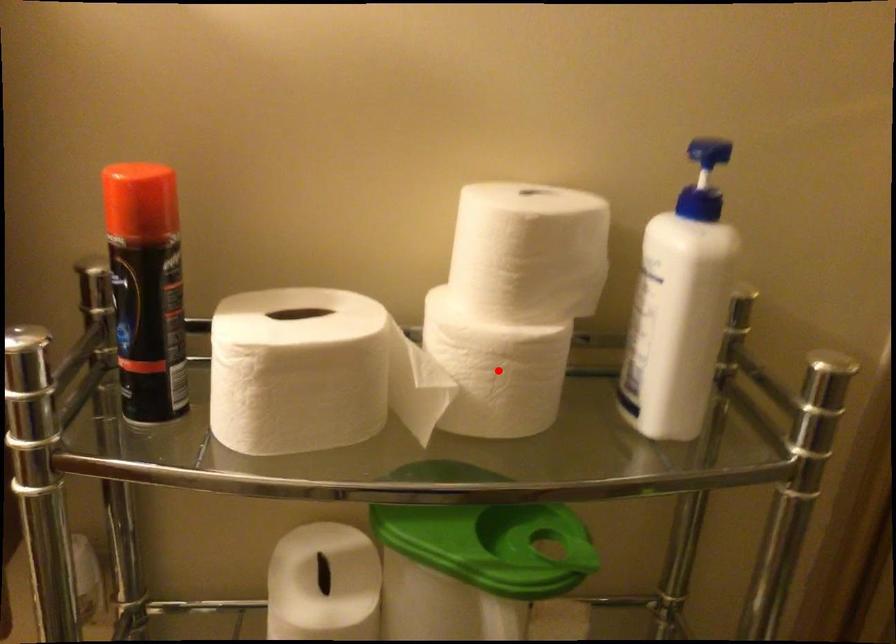
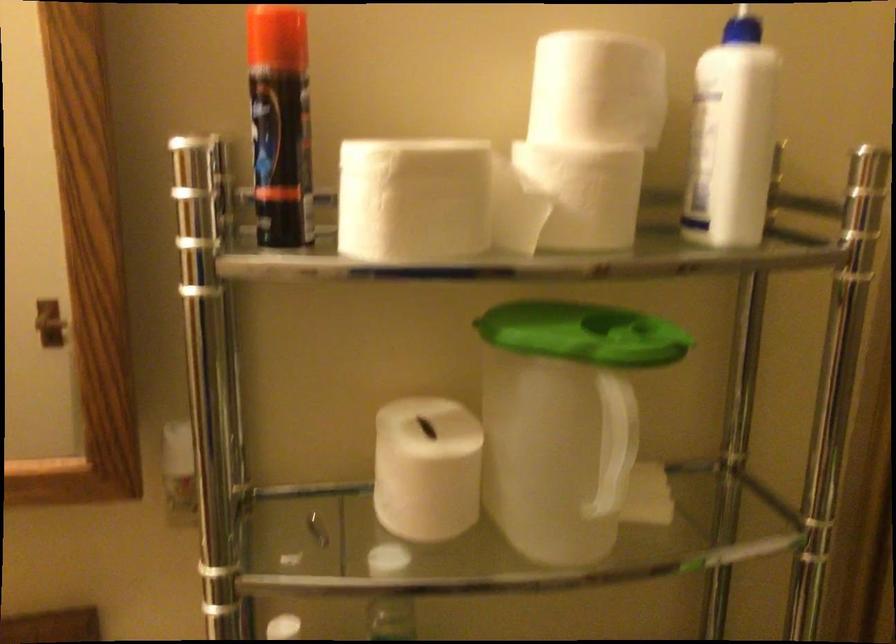
In the second image, find the point that corresponds to the highlighted location in the first image.

(588, 194)